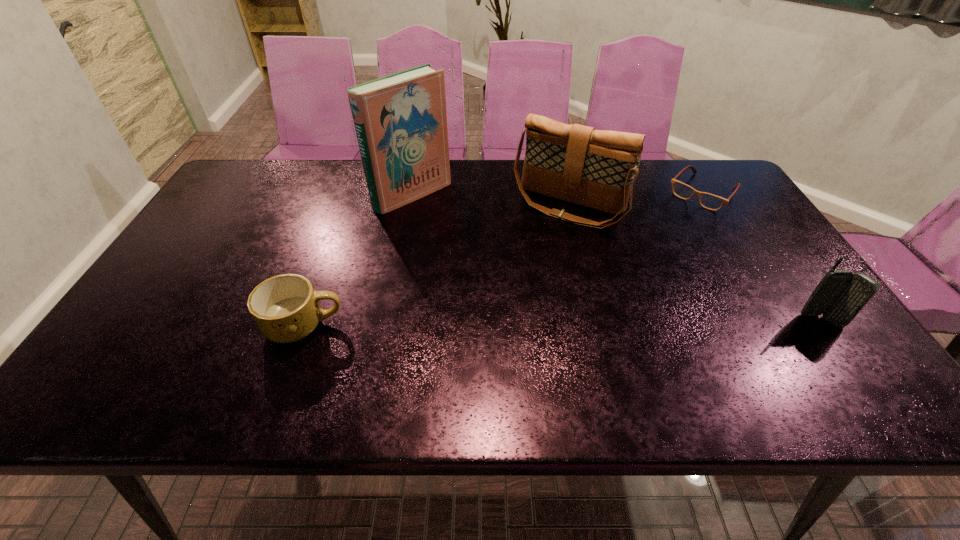
Image resolution: width=960 pixels, height=540 pixels. Find the location of `free space at the near right corner of the desktop`. free space at the near right corner of the desktop is located at coordinates (852, 357).

The image size is (960, 540). Identify the location of free space between the second tallest object and the shortest object. (636, 199).

Identify the location of vacant area between the third shortest object and the second tallest object. (695, 264).

Where is `free point between the tallest object and the second tallest object`? free point between the tallest object and the second tallest object is located at coordinates (491, 200).

Locate an element on the screen. vacant region between the tallest object and the cellular telephone is located at coordinates (617, 258).

The height and width of the screenshot is (540, 960). Find the location of `free area in between the third tallest object and the mug`. free area in between the third tallest object and the mug is located at coordinates (563, 323).

Locate an element on the screen. This screenshot has width=960, height=540. free area in between the tallest object and the shoulder bag is located at coordinates (491, 200).

Find the location of a particular element. Image resolution: width=960 pixels, height=540 pixels. vacant area that lies between the hardback book and the fourth tallest object is located at coordinates (358, 260).

Locate which object ranks in proximity to the shortest object. Please provide its 2D coordinates. Your answer should be formatted as a tuple, i.e. [(x, y)], where the tuple contains the x and y coordinates of a point satisfying the conditions above.

[(575, 163)]

The height and width of the screenshot is (540, 960). I want to click on object that is the second closest to the tallest object, so click(x=286, y=308).